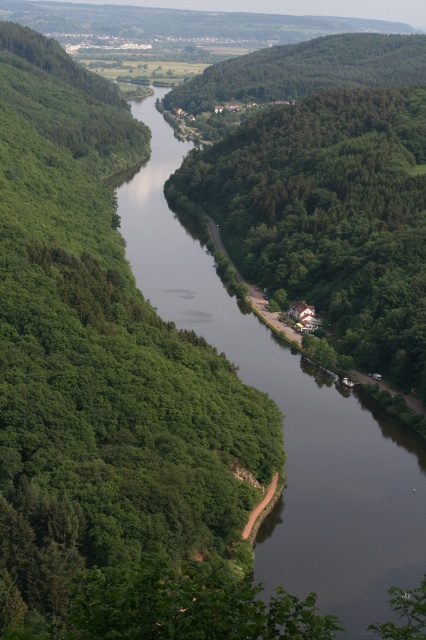
In the scene shown: You are a hiker standing at the edge of the settlement on the right bank of the river. You want to cross the river to the opposite side. The green leafy tree at center and the dark reflective water at center are in your line of sight. Which object is closer to you in terms of distance?

The green leafy tree at center is closer to you than the dark reflective water at center because the tree is at the center of the scene, while the water is also at the center but the tree is smaller in size, indicating it might be closer.

You are a hiker standing on the right bank of the river. You see a green leafy tree at center and dark reflective water at center. Which object is closer to you?

The green leafy tree at center is positioned over dark reflective water at center, so the tree is closer to you than the water.

You are a hiker standing on the right bank of the river and want to take a photo of the green leafy tree at center and the dark reflective water at center. Which object will appear taller in your photo?

The dark reflective water at center appears taller than the green leafy tree at center in the photo because the description states that the green leafy tree at center is shorter than the dark reflective water at center.